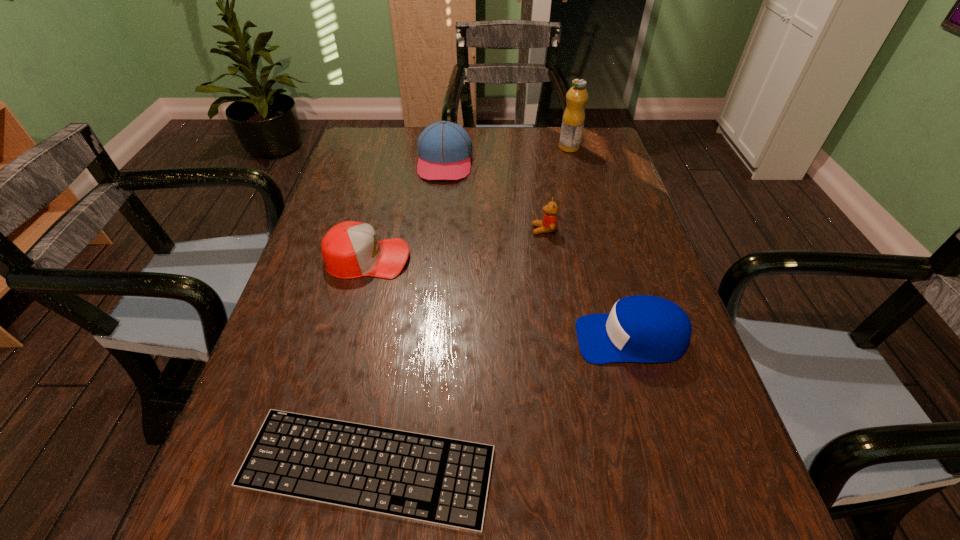
What are the coordinates of `free location that satisfies the following two spatial constraints: 1. on the front label of the fruit juice; 2. on the front side of the nearest object` in the screenshot? It's located at (656, 467).